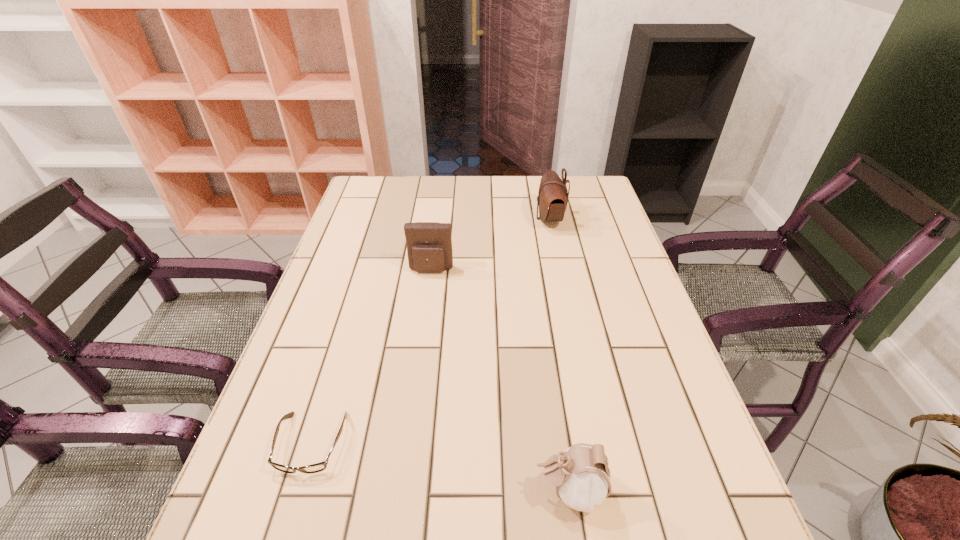
Where is `the farthest object`? This screenshot has height=540, width=960. the farthest object is located at coordinates (552, 198).

Locate an element on the screen. The width and height of the screenshot is (960, 540). the third nearest object is located at coordinates (429, 246).

Identify the location of the second farthest pouch. (429, 246).

The width and height of the screenshot is (960, 540). In order to click on the nearest pouch in this screenshot , I will do `click(581, 475)`.

Find the location of a particular element. spectacles is located at coordinates (318, 467).

The width and height of the screenshot is (960, 540). What are the coordinates of `the shortest object` in the screenshot? It's located at (318, 467).

Where is `free space located 0.380m with the flap open on the farthest object`? free space located 0.380m with the flap open on the farthest object is located at coordinates (415, 219).

Where is `vacant space positioned with the flap open on the farthest object`? vacant space positioned with the flap open on the farthest object is located at coordinates point(440,219).

Find the location of a particular element. vacant space situated 0.050m with the flap open on the farthest object is located at coordinates (519, 219).

You are a GUI agent. You are given a task and a screenshot of the screen. Output one action in this format:
    pyautogui.click(x=<x>, y=<y>)
    Task: Click on the vacant space situated with an open flap on the second nearest pouch
    
    Given the screenshot: What is the action you would take?
    pyautogui.click(x=415, y=398)